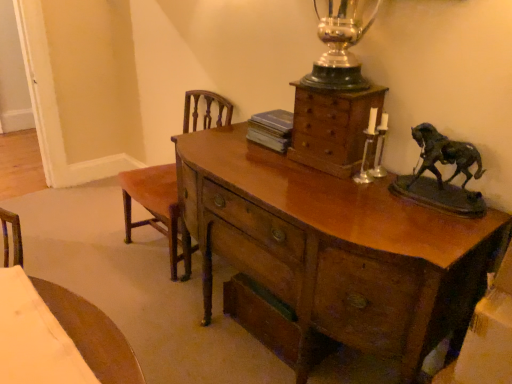
Question: Considering the relative positions of wooden chest of drawers at upper center and glossy wood desk at center in the image provided, is wooden chest of drawers at upper center to the right of glossy wood desk at center from the viewer's perspective?

Choices:
 (A) no
 (B) yes

Answer: (B)

Question: Does wooden chest of drawers at upper center have a smaller size compared to glossy wood desk at center?

Choices:
 (A) no
 (B) yes

Answer: (B)

Question: Is wooden chest of drawers at upper center facing towards glossy wood desk at center?

Choices:
 (A) no
 (B) yes

Answer: (A)

Question: Is wooden chest of drawers at upper center far from glossy wood desk at center?

Choices:
 (A) yes
 (B) no

Answer: (B)

Question: Is wooden chest of drawers at upper center behind glossy wood desk at center?

Choices:
 (A) yes
 (B) no

Answer: (A)

Question: Is blue paperback book at center to the left or to the right of wooden chest of drawers at upper center in the image?

Choices:
 (A) left
 (B) right

Answer: (A)

Question: In terms of width, does blue paperback book at center look wider or thinner when compared to wooden chest of drawers at upper center?

Choices:
 (A) thin
 (B) wide

Answer: (A)

Question: Considering the positions of point (276, 144) and point (352, 145), is point (276, 144) closer or farther from the camera than point (352, 145)?

Choices:
 (A) farther
 (B) closer

Answer: (A)

Question: Is blue paperback book at center inside or outside of wooden chest of drawers at upper center?

Choices:
 (A) inside
 (B) outside

Answer: (B)

Question: Looking at their shapes, would you say brown wood chair at left is wider or thinner than wooden chest of drawers at upper center?

Choices:
 (A) wide
 (B) thin

Answer: (A)

Question: Is brown wood chair at left in front of or behind wooden chest of drawers at upper center in the image?

Choices:
 (A) front
 (B) behind

Answer: (B)

Question: From a real-world perspective, is brown wood chair at left physically located above or below wooden chest of drawers at upper center?

Choices:
 (A) below
 (B) above

Answer: (A)

Question: Would you say brown wood chair at left is to the left or to the right of wooden chest of drawers at upper center in the picture?

Choices:
 (A) right
 (B) left

Answer: (B)

Question: Considering the positions of point (216, 97) and point (195, 215), is point (216, 97) closer or farther from the camera than point (195, 215)?

Choices:
 (A) farther
 (B) closer

Answer: (A)

Question: In terms of width, does brown wood chair at left look wider or thinner when compared to glossy wood desk at center?

Choices:
 (A) wide
 (B) thin

Answer: (B)